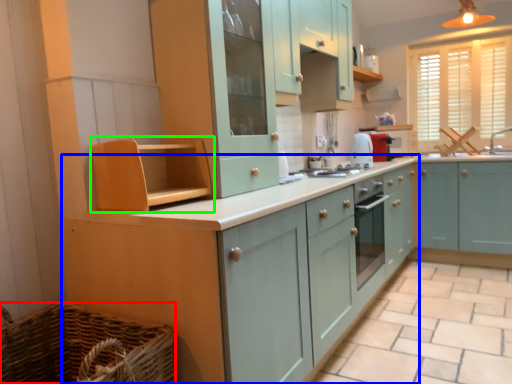
Question: Estimate the real-world distances between objects in this image. Which object is farther from basket (highlighted by a red box), cabinetry (highlighted by a blue box) or cabinetry (highlighted by a green box)?

Choices:
 (A) cabinetry
 (B) cabinetry

Answer: (B)